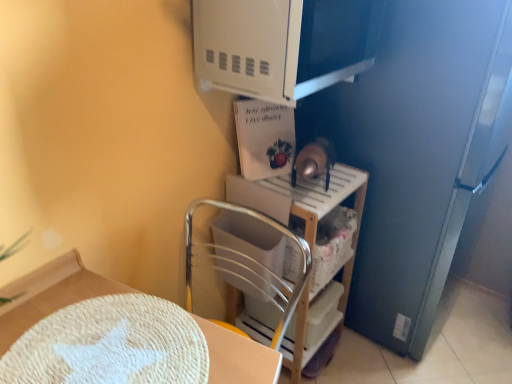
This screenshot has height=384, width=512. What are the coordinates of `white matte microwave at upper center` in the screenshot? It's located at (282, 45).

From the picture: Considering the sizes of objects white woven placemat at lower left and wooden shelf at center in the image provided, who is thinner, white woven placemat at lower left or wooden shelf at center?

Thinner between the two is wooden shelf at center.

Looking at this image, how different are the orientations of white woven placemat at lower left and wooden shelf at center in degrees?

The angular difference between white woven placemat at lower left and wooden shelf at center is 1.62 degrees.

Is point (106, 291) more distant than point (305, 304)?

No.

This screenshot has width=512, height=384. Identify the location of furniture located in front of the wooden shelf at center. coord(50,294).

Does point (72, 285) appear closer or farther from the camera than point (246, 30)?

Point (72, 285).

From the image's perspective, which object appears higher, white woven placemat at lower left or white matte microwave at upper center?

→ From the image's view, white matte microwave at upper center is above.

Is white woven placemat at lower left positioned beyond the bounds of white matte microwave at upper center?

Yes, white woven placemat at lower left is not within white matte microwave at upper center.

I want to click on furniture that is in front of the white matte microwave at upper center, so click(x=50, y=294).

In the scene shown: Is white matte microwave at upper center facing away from white woven placemat at lower left?

white matte microwave at upper center does not have its back to white woven placemat at lower left.

Between white matte microwave at upper center and white woven placemat at lower left, which one has smaller size?

With smaller size is white woven placemat at lower left.

Does white matte microwave at upper center have a greater width compared to white woven placemat at lower left?

No, white matte microwave at upper center is not wider than white woven placemat at lower left.

Is white matte microwave at upper center at the left side of white woven placemat at lower left?

No.

Consider the image. Does wooden shelf at center touch white woven placemat at lower left?

They are not placed beside each other.

Is point (309, 233) less distant than point (248, 339)?

No, it is not.

Can you tell me how much wooden shelf at center and white woven placemat at lower left differ in facing direction?

The facing directions of wooden shelf at center and white woven placemat at lower left are 1.62 degrees apart.

From the picture: Could you tell me if white matte microwave at upper center is facing wooden shelf at center?

No, white matte microwave at upper center does not turn towards wooden shelf at center.

Is white matte microwave at upper center with wooden shelf at center?

white matte microwave at upper center and wooden shelf at center are clearly separated.

Can you confirm if white matte microwave at upper center is wider than wooden shelf at center?

In fact, white matte microwave at upper center might be narrower than wooden shelf at center.

Is white matte microwave at upper center located outside wooden shelf at center?

Yes.

Is wooden shelf at center thinner than white matte microwave at upper center?

No.

Looking at this image, who is more distant, wooden shelf at center or white matte microwave at upper center?

Positioned behind is wooden shelf at center.

Can you confirm if wooden shelf at center is positioned to the right of white matte microwave at upper center?

Indeed, wooden shelf at center is positioned on the right side of white matte microwave at upper center.

Is white matte microwave at upper center located within wooden shelf at center?

Definitely not — white matte microwave at upper center is not inside wooden shelf at center.

Locate an element on the screen. This screenshot has width=512, height=384. furniture below the wooden shelf at center (from the image's perspective) is located at coordinates (50, 294).

Find the location of a particular element. appliance on the right of the white woven placemat at lower left is located at coordinates (282, 45).

Which object lies further to the anchor point white woven placemat at lower left, white matte microwave at upper center or wooden shelf at center?

white matte microwave at upper center.

Which object lies nearer to the anchor point white matte microwave at upper center, white woven placemat at lower left or wooden shelf at center?

wooden shelf at center is positioned closer to the anchor white matte microwave at upper center.

From the image, which object appears to be farther from white woven placemat at lower left, wooden shelf at center or white matte microwave at upper center?

white matte microwave at upper center lies further to white woven placemat at lower left than the other object.

Based on their spatial positions, is wooden shelf at center or white woven placemat at lower left further from white matte microwave at upper center?

white woven placemat at lower left is positioned further to the anchor white matte microwave at upper center.

Estimate the real-world distances between objects in this image. Which object is further from wooden shelf at center, white woven placemat at lower left or white matte microwave at upper center?

white woven placemat at lower left is further to wooden shelf at center.

When comparing their distances from wooden shelf at center, does white matte microwave at upper center or white woven placemat at lower left seem closer?

white matte microwave at upper center is positioned closer to the anchor wooden shelf at center.

Identify the location of shelf that lies between white matte microwave at upper center and white woven placemat at lower left from top to bottom. (300, 197).